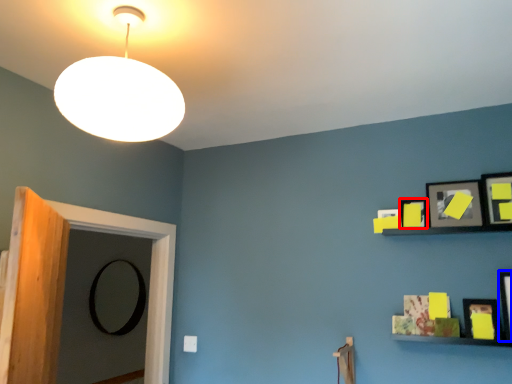
Question: Which object is further to the camera taking this photo, picture frame (highlighted by a red box) or picture frame (highlighted by a blue box)?

Choices:
 (A) picture frame
 (B) picture frame

Answer: (A)